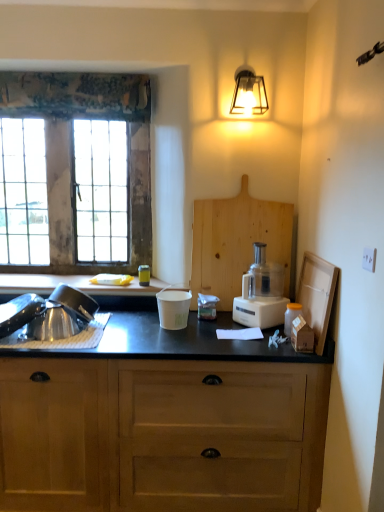
Question: From a real-world perspective, is wooden cabinet at lower center above or below brushed metal sink at lower left?

Choices:
 (A) below
 (B) above

Answer: (A)

Question: Which is correct: wooden cabinet at lower center is inside brushed metal sink at lower left, or outside of it?

Choices:
 (A) outside
 (B) inside

Answer: (A)

Question: Estimate the real-world distances between objects in this image. Which object is farther from the black matte countertop at left?

Choices:
 (A) cardboard box at right
 (B) metallic lantern at upper right
 (C) wooden window at left
 (D) wooden cabinet at lower center
 (E) white plastic food processor at center-right

Answer: (B)

Question: Estimate the real-world distances between objects in this image. Which object is farther from the metallic lantern at upper right?

Choices:
 (A) brushed metal sink at lower left
 (B) white plastic food processor at center-right
 (C) wooden window at left
 (D) cardboard box at right
 (E) wooden cabinet at lower center

Answer: (E)